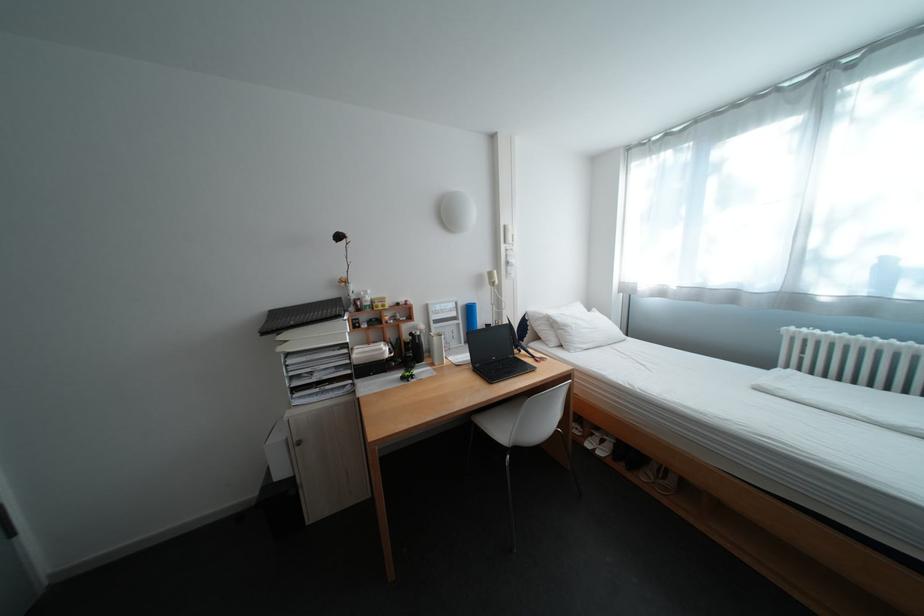
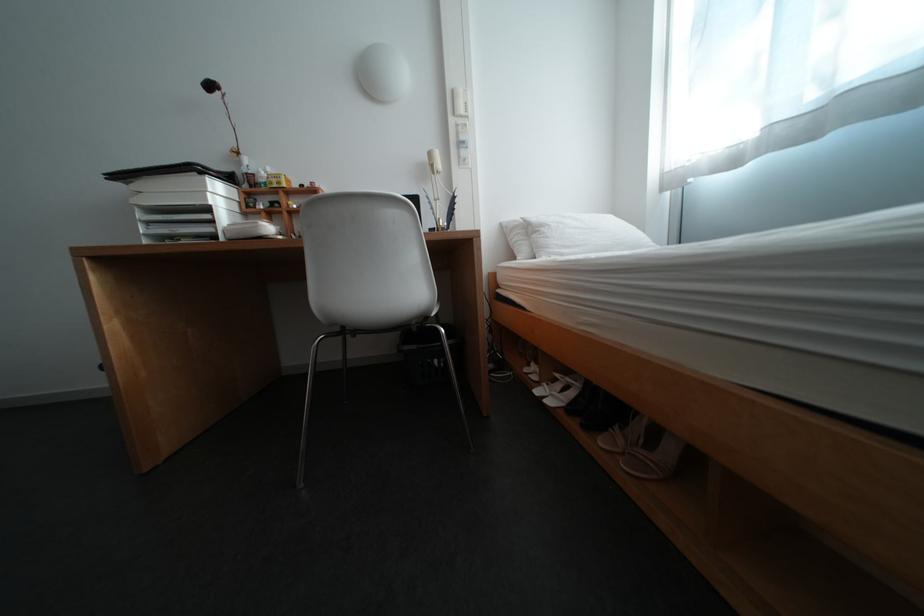
Find the pixel in the second image that matches (x=604, y=436) in the first image.

(568, 381)